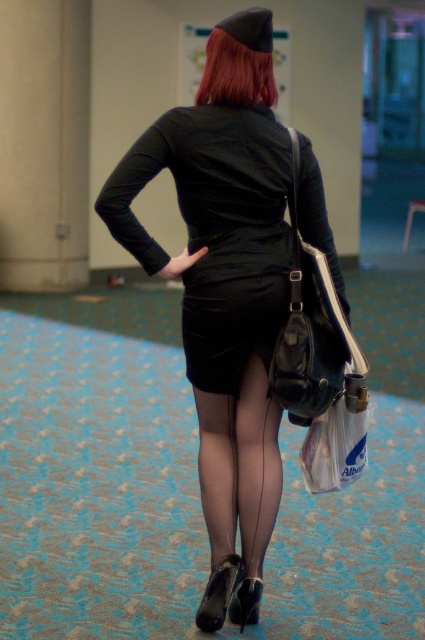
Looking at this image, you are a photographer trying to capture the black satin dress at center and the translucent plastic bag at lower center in a single shot. Which object should you focus on first to ensure both are in focus?

You should focus on the black satin dress at center first because it is closer to the viewer than the translucent plastic bag at lower center, so focusing on the closer object will ensure the farther one is also in focus.

From the picture: You are a photographer standing in the convention center. You want to take a closeup shot of the black sheer tights at center. Considering the camera focus range requires the subject to be at least 12 feet away, will you be able to capture a clear photo?

The black sheer tights at center are currently 10.26 feet away from the camera, which is closer than the required 12 feet focus distance. Therefore, the photographer cannot take a clear closeup photo as the subject is too near.